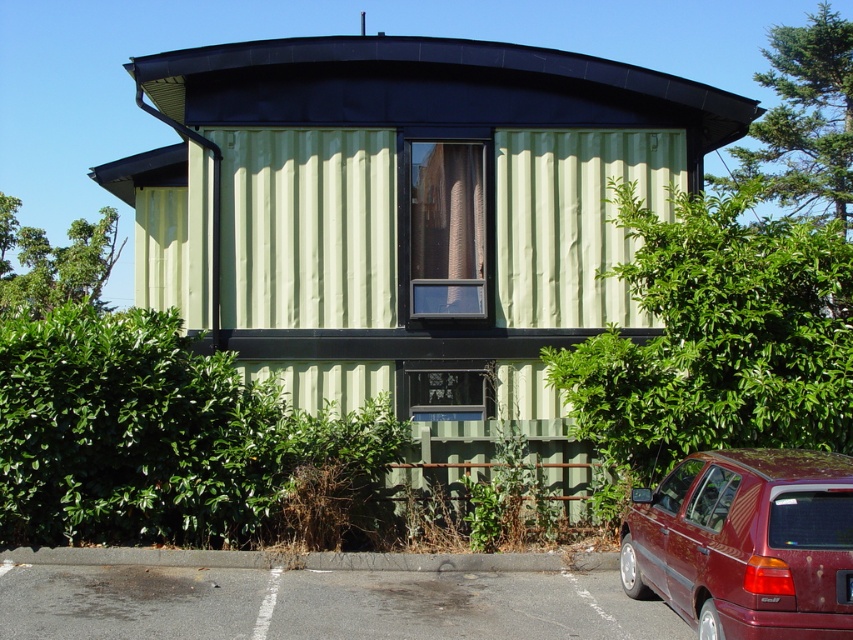
From the picture: You are a delivery driver who needs to park your shiny maroon hatchback at lower right near the gray asphalt parking lot at lower left. Based on the scene, can you determine if the parking lot is to the left or right side of your car?

The gray asphalt parking lot at lower left is positioned on the left side of the shiny maroon hatchback at lower right, so the parking lot is to the left side of the car.

You are a delivery driver who needs to park your shiny maroon hatchback at lower right close to the gray asphalt parking lot at lower left. Can you safely maneuver your vehicle into the parking spot next to the parking lot?

The gray asphalt parking lot at lower left is 4.03 feet away from the shiny maroon hatchback at lower right. Since the distance between them is only 4.03 feet, it might be difficult to safely maneuver the vehicle into the parking spot as this distance is typically too narrow for a car. Please check for a wider space.